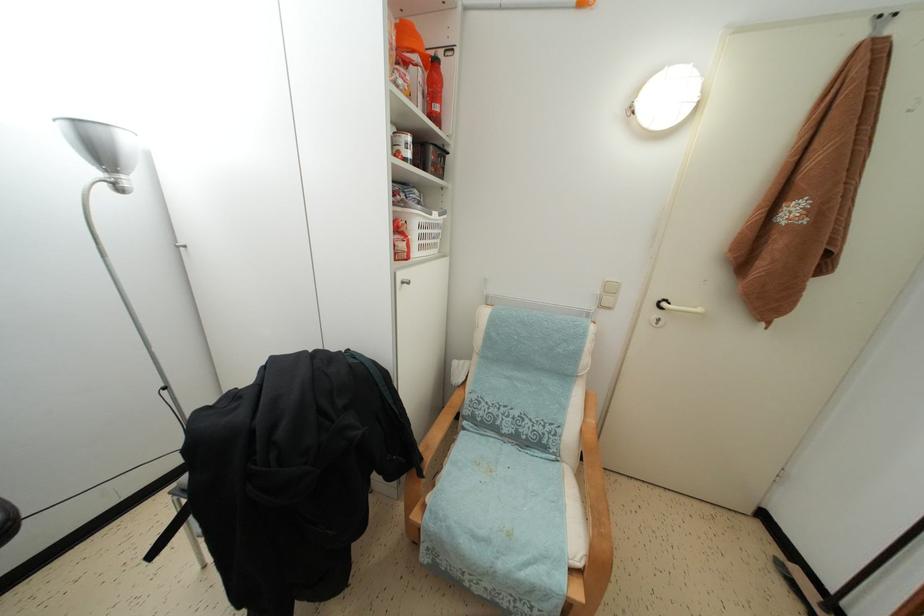
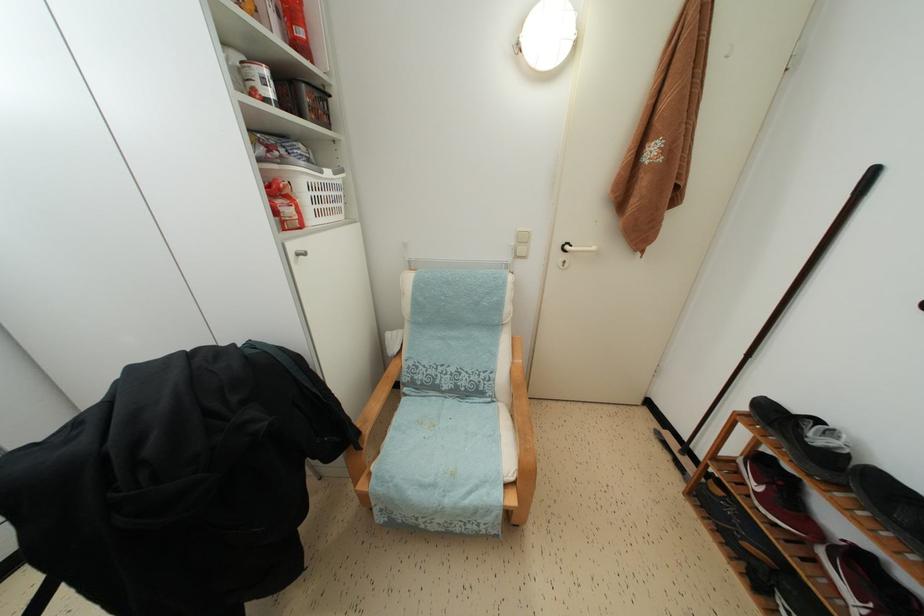
The point at (614, 294) is marked in the first image. Where is the corresponding point in the second image?

(527, 245)